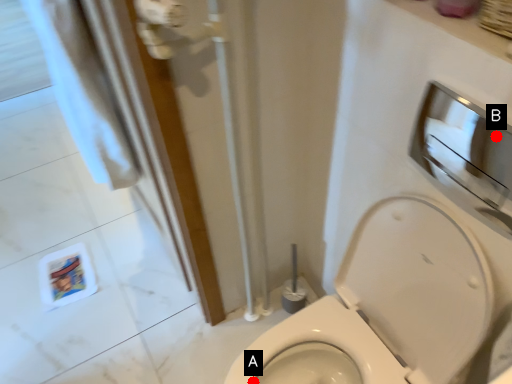
Question: Two points are circled on the image, labeled by A and B beside each circle. Which point is closer to the camera?

Choices:
 (A) A is closer
 (B) B is closer

Answer: (A)